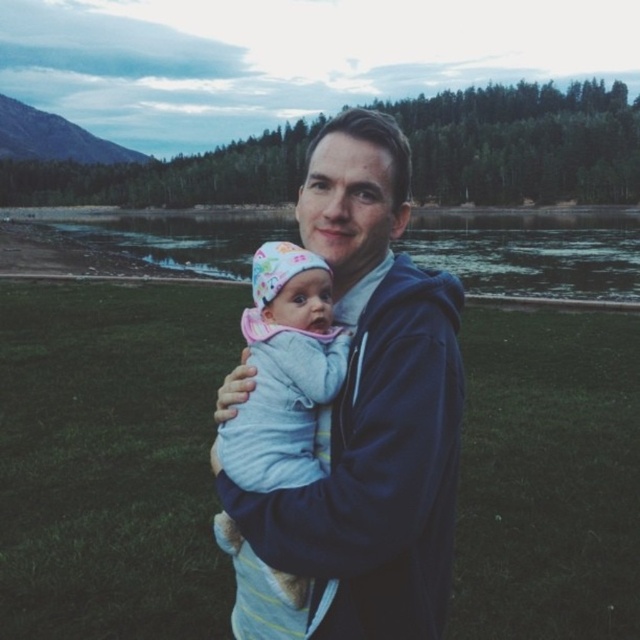
Who is more distant from viewer, (257, 627) or (209, 252)?

Positioned behind is point (209, 252).

Who is more forward, [349,154] or [560,234]?

Positioned in front is point [349,154].

Which is in front, point (420, 518) or point (456, 220)?

Point (420, 518)

This screenshot has width=640, height=640. I want to click on dark blue hoodie at center, so click(x=365, y=417).

Measure the distance from green grass at center to light blue knit sweater at center.

A distance of 100.19 meters exists between green grass at center and light blue knit sweater at center.

Between green grass at center and light blue knit sweater at center, which one appears on the right side from the viewer's perspective?

From the viewer's perspective, light blue knit sweater at center appears more on the right side.

Between point (612, 273) and point (314, 358), which one is positioned behind?

The point (612, 273) is behind.

The image size is (640, 640). Find the location of `green grass at center`. green grass at center is located at coordinates (532, 252).

Measure the distance between point (416, 362) and camera.

Point (416, 362) is 5.51 meters from camera.

Is dark blue hoodie at center positioned at the back of light blue knit sweater at center?

No, dark blue hoodie at center is closer to the viewer.

Which is in front, point (438, 534) or point (298, 419)?

Positioned in front is point (438, 534).

Locate an element on the screen. The height and width of the screenshot is (640, 640). dark blue hoodie at center is located at coordinates (365, 417).